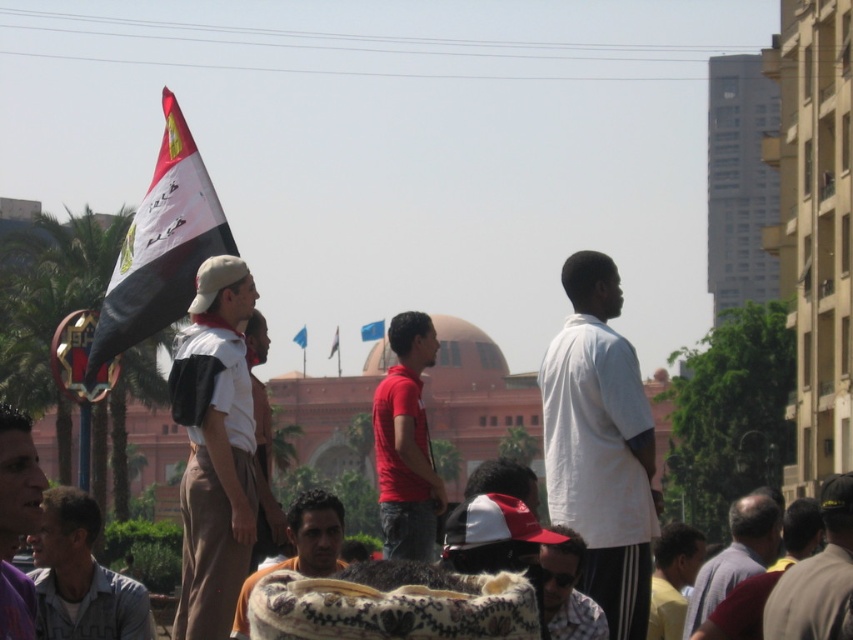
You are a photographer at the event and want to capture a photo that includes both the white matte shirt at center and the blue fabric flag at upper center. Which object should you focus on first to ensure both are in sharp focus?

You should focus on the white matte shirt at center first because it is closer to the viewer than the blue fabric flag at upper center, ensuring both will be in focus when focusing on the closer object.